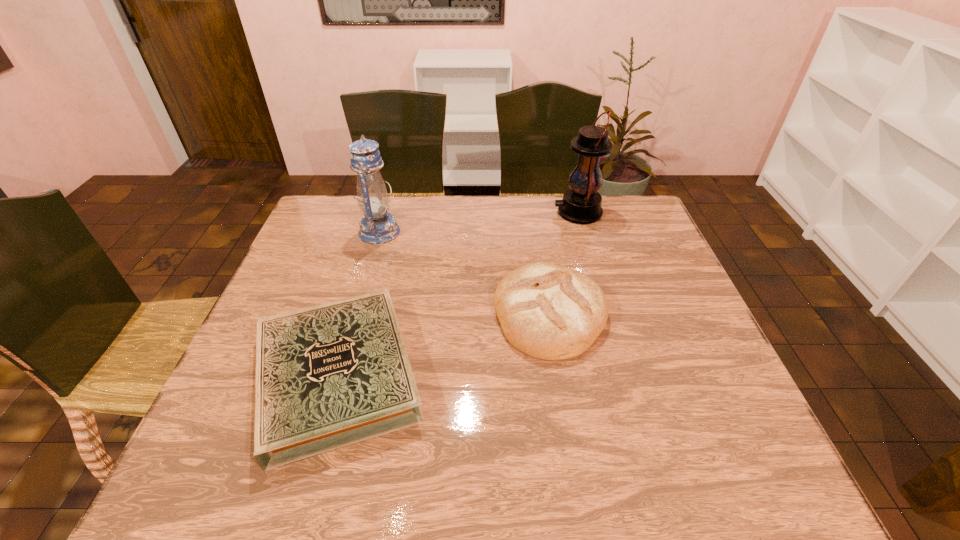
Find the location of a particular element. This screenshot has height=540, width=960. vacant space at the near right corner of the desktop is located at coordinates (747, 461).

I want to click on vacant area that lies between the hardback book and the right lantern, so click(x=458, y=294).

The width and height of the screenshot is (960, 540). I want to click on vacant area that lies between the shortest object and the third tallest object, so click(x=444, y=345).

Find the location of a particular element. The image size is (960, 540). unoccupied area between the shortest object and the third tallest object is located at coordinates (444, 345).

You are a GUI agent. You are given a task and a screenshot of the screen. Output one action in this format:
    pyautogui.click(x=<x>, y=<y>)
    Task: Click on the vacant space that is in between the left lantern and the right lantern
    
    Given the screenshot: What is the action you would take?
    pyautogui.click(x=479, y=222)

Where is `vacant space that's between the third tallest object and the right lantern`? Image resolution: width=960 pixels, height=540 pixels. vacant space that's between the third tallest object and the right lantern is located at coordinates (564, 263).

Identify the location of vacant area that lies between the left lantern and the right lantern. This screenshot has width=960, height=540. (479, 222).

The width and height of the screenshot is (960, 540). Find the location of `free spot between the hardback book and the bread`. free spot between the hardback book and the bread is located at coordinates (444, 345).

Identify the location of vacant area that lies between the right lantern and the left lantern. (479, 222).

Locate an element on the screen. The image size is (960, 540). vacant space in between the left lantern and the second shortest object is located at coordinates (465, 273).